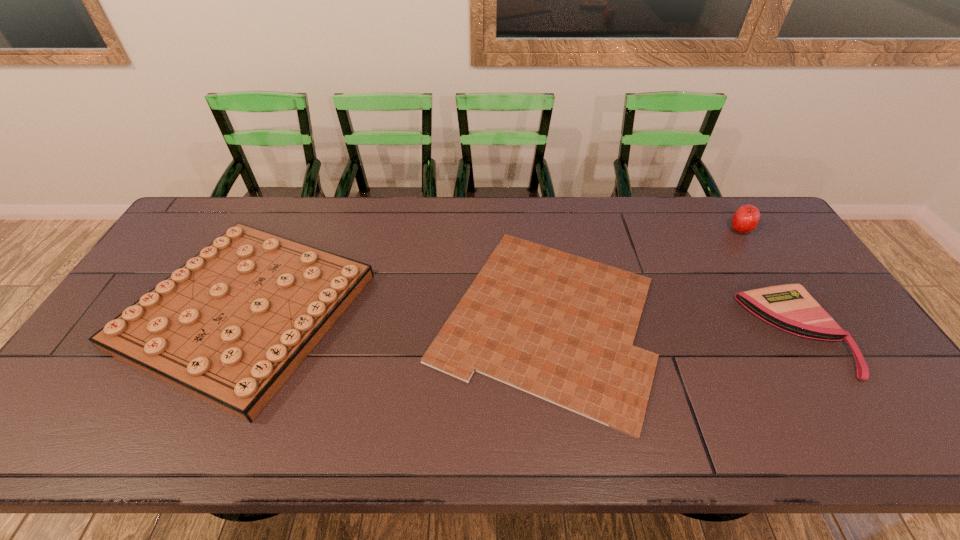
Identify the location of free spot that satisfies the following two spatial constraints: 1. on the back side of the apple; 2. on the left side of the second shortest object. (732, 230).